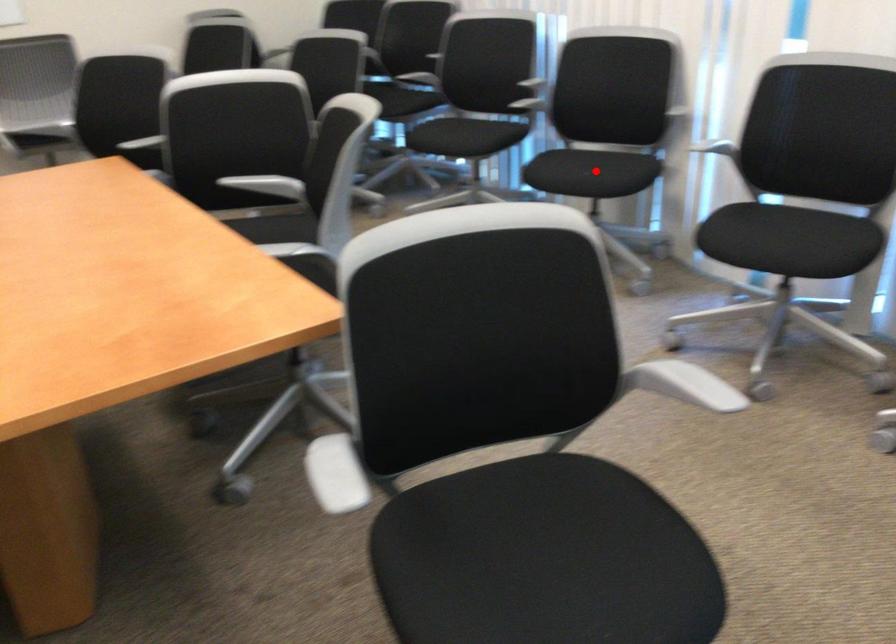
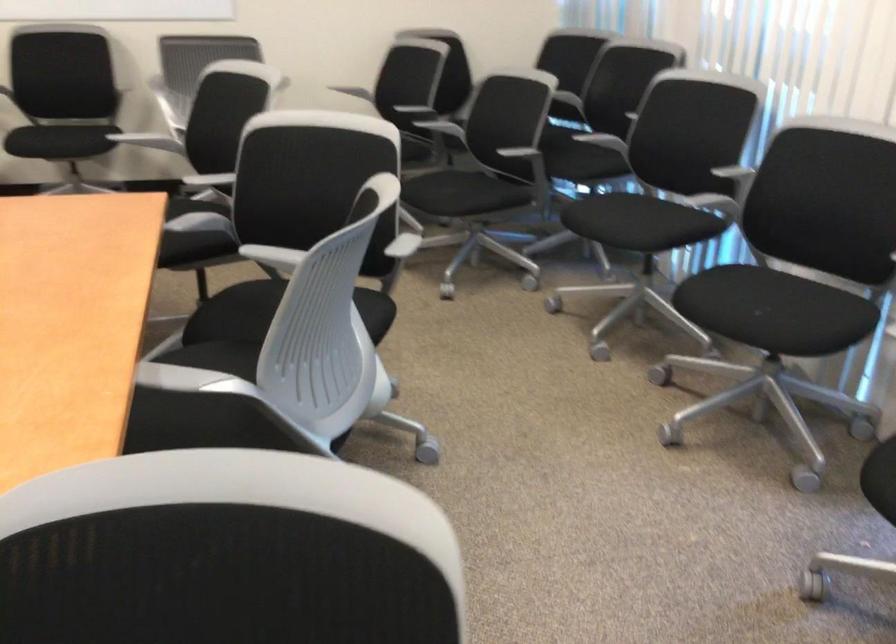
Locate, in the second image, the point that corresponds to the highlighted location in the first image.

(771, 310)